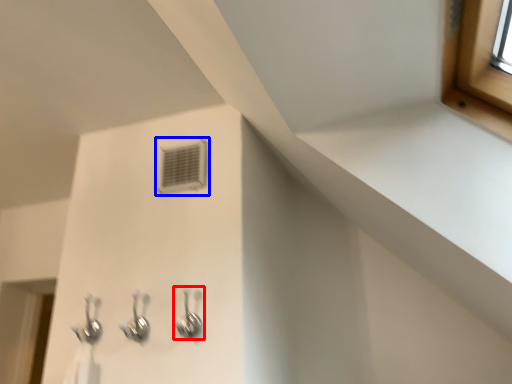
Question: Which object appears farthest to the camera in this image, plumbing fixture (highlighted by a red box) or air conditioning (highlighted by a blue box)?

Choices:
 (A) plumbing fixture
 (B) air conditioning

Answer: (B)